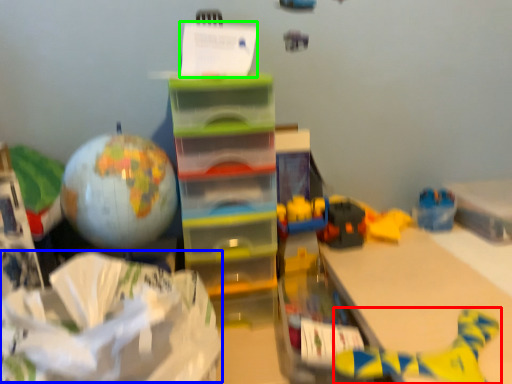
Question: Which object is positioned closest to toy (highlighted by a red box)? Select from wrapping paper (highlighted by a blue box) and writing (highlighted by a green box).

Choices:
 (A) wrapping paper
 (B) writing

Answer: (A)